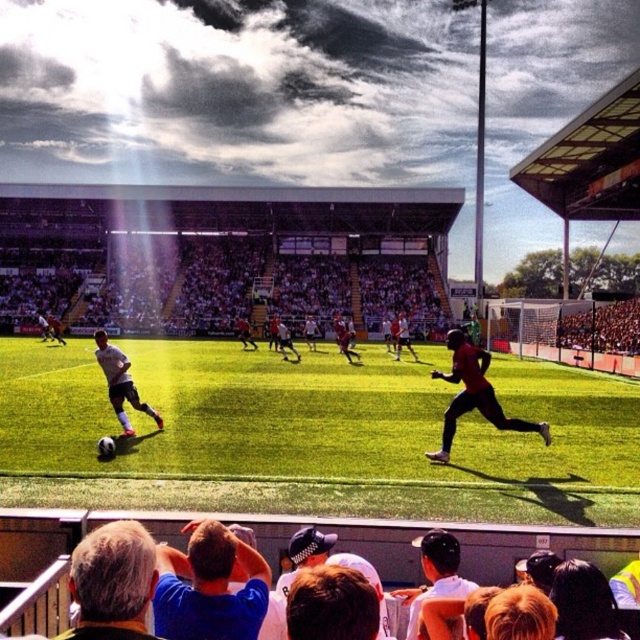
Question: Is green grass football field at center positioned at the back of matte red jersey at center?

Choices:
 (A) no
 (B) yes

Answer: (A)

Question: Can you confirm if gray hair at lower left is wider than brown hair at center?

Choices:
 (A) yes
 (B) no

Answer: (A)

Question: Is the position of matte red jersey at center more distant than that of white matte soccer player at center?

Choices:
 (A) no
 (B) yes

Answer: (A)

Question: Which object is positioned closest to the dark brown leather cap at center?

Choices:
 (A) blue shirt at lower center
 (B) matte red jersey at center
 (C) gray hair at lower left
 (D) brown hair at center

Answer: (A)

Question: Among these objects, which one is nearest to the camera?

Choices:
 (A) dark brown leather cap at center
 (B) matte red jersey at center
 (C) gray hair at lower left
 (D) white matte soccer player at center

Answer: (C)

Question: Which point is farther to the camera?

Choices:
 (A) (416, 486)
 (B) (84, 580)

Answer: (A)